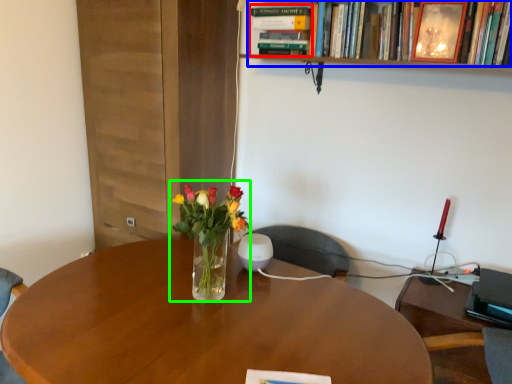
Question: Which is farther away from book (highlighted by a red box)? book (highlighted by a blue box) or floral arrangement (highlighted by a green box)?

Choices:
 (A) book
 (B) floral arrangement

Answer: (B)